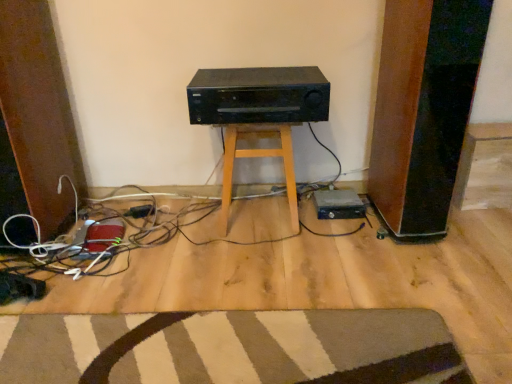
Question: Is black plastic plug at lower center at the back of black plastic hard drive at lower right?

Choices:
 (A) no
 (B) yes

Answer: (A)

Question: From a real-world perspective, is black plastic hard drive at lower right positioned under black plastic plug at lower center based on gravity?

Choices:
 (A) yes
 (B) no

Answer: (A)

Question: Is black plastic plug at lower center inside black plastic hard drive at lower right?

Choices:
 (A) yes
 (B) no

Answer: (B)

Question: Considering the relative sizes of black plastic hard drive at lower right and black plastic plug at lower center in the image provided, is black plastic hard drive at lower right thinner than black plastic plug at lower center?

Choices:
 (A) no
 (B) yes

Answer: (A)

Question: Is black plastic hard drive at lower right smaller than black plastic plug at lower center?

Choices:
 (A) yes
 (B) no

Answer: (B)

Question: Is black plastic hard drive at lower right positioned in front of black plastic plug at lower center?

Choices:
 (A) yes
 (B) no

Answer: (A)

Question: Can you see striped carpet at lower center touching black plastic plug at lower center?

Choices:
 (A) yes
 (B) no

Answer: (B)

Question: From the image's perspective, is striped carpet at lower center located beneath black plastic plug at lower center?

Choices:
 (A) yes
 (B) no

Answer: (A)

Question: Considering the relative sizes of striped carpet at lower center and black plastic plug at lower center in the image provided, is striped carpet at lower center thinner than black plastic plug at lower center?

Choices:
 (A) yes
 (B) no

Answer: (B)

Question: Is striped carpet at lower center facing away from black plastic plug at lower center?

Choices:
 (A) no
 (B) yes

Answer: (A)

Question: Is striped carpet at lower center facing towards black plastic plug at lower center?

Choices:
 (A) no
 (B) yes

Answer: (A)

Question: From a real-world perspective, is striped carpet at lower center on black plastic plug at lower center?

Choices:
 (A) no
 (B) yes

Answer: (A)

Question: Can you confirm if black matte stereo at center is shorter than wooden stool at center?

Choices:
 (A) no
 (B) yes

Answer: (B)